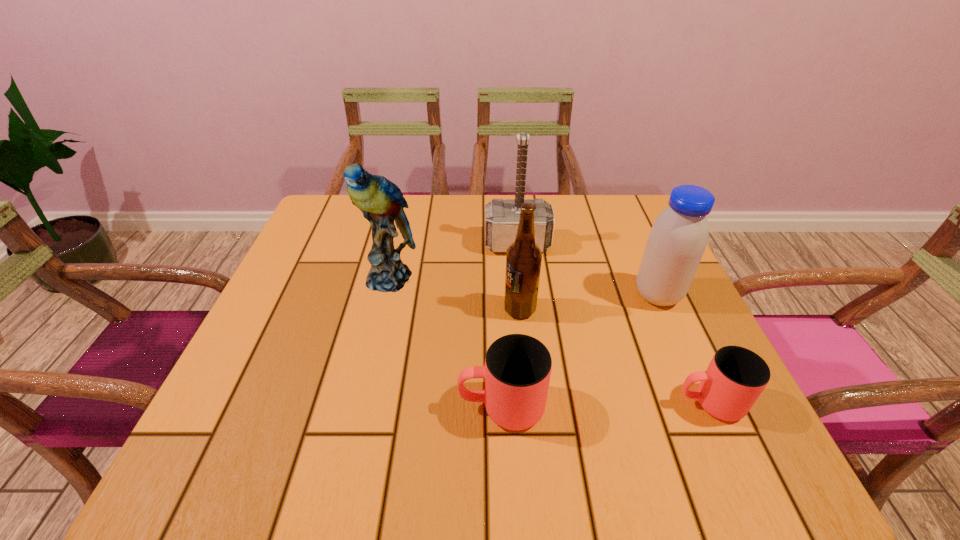
You are a GUI agent. You are given a task and a screenshot of the screen. Output one action in this format:
    pyautogui.click(x=<x>, y=<y>)
    Task: Click on the object that is at the far edge
    The width and height of the screenshot is (960, 540).
    Given the screenshot: What is the action you would take?
    pyautogui.click(x=502, y=217)

Image resolution: width=960 pixels, height=540 pixels. In order to click on cup at the right edge in this screenshot , I will do `click(736, 376)`.

This screenshot has width=960, height=540. Identify the location of soya milk that is at the right edge. (677, 240).

Where is `object located at the near right corner`? The width and height of the screenshot is (960, 540). object located at the near right corner is located at coordinates (736, 376).

Where is `vacant space at the far edge`? This screenshot has height=540, width=960. vacant space at the far edge is located at coordinates (576, 210).

This screenshot has width=960, height=540. Find the location of `vacant area at the near edge`. vacant area at the near edge is located at coordinates (368, 401).

In the image, there is a desktop. At what (x,y) coordinates should I click in order to perform the action: click on vacant space at the left edge. Please return your answer as a coordinate pair (x, y). Looking at the image, I should click on (291, 278).

Locate an element on the screen. free space at the near left corner of the desktop is located at coordinates (256, 386).

The height and width of the screenshot is (540, 960). In order to click on free point between the left cup and the right cup in this screenshot , I will do `click(606, 405)`.

Where is `unoccupied position between the taller cup and the soya milk`? The height and width of the screenshot is (540, 960). unoccupied position between the taller cup and the soya milk is located at coordinates (580, 351).